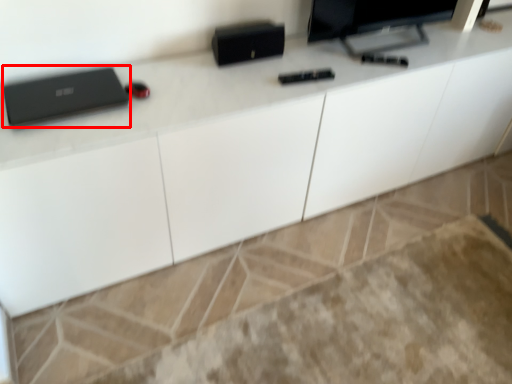
Question: Considering the relative positions of laptop (annotated by the red box) and computer monitor in the image provided, where is laptop (annotated by the red box) located with respect to the staircase?

Choices:
 (A) left
 (B) right

Answer: (A)